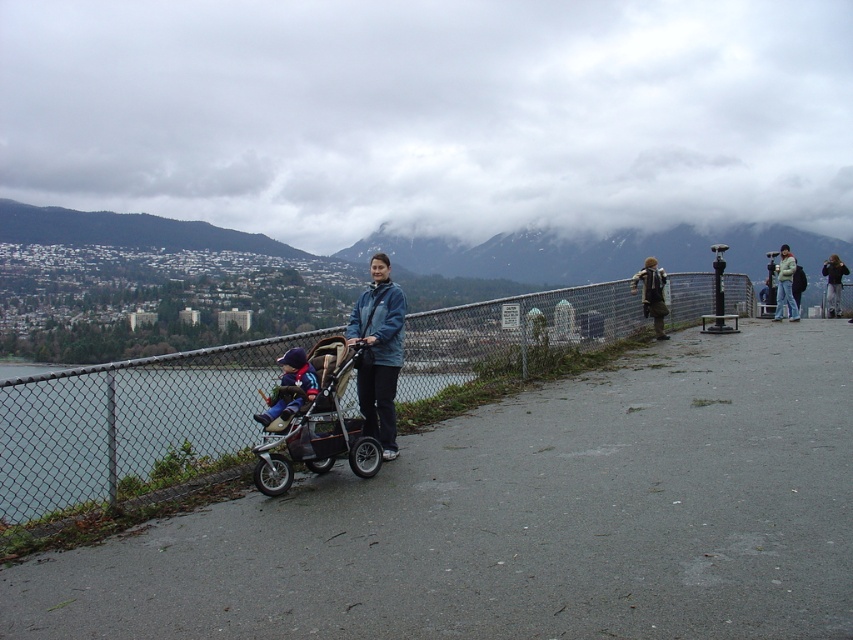
You are a tourist visiting the viewpoint and want to take a photo of the clear water at stroller left and the blue fleece jacket at center. Which object should you focus on first if you want to capture both in the same frame without moving your camera?

The clear water at stroller left is positioned on the left side of the blue fleece jacket at center, so you should focus on the blue fleece jacket at center first to ensure both are in the frame.

Based on the photo, you are a photographer planning to take a picture of the clear water at stroller left and the blue fleece jacket at center. Which object should you focus on first if you want to capture both in a single shot without moving the camera?

The blue fleece jacket at center is closer to the photographer than the clear water at stroller left, so focusing on the blue fleece jacket at center first will ensure both are in focus.

You are a photographer at the viewpoint. You want to capture a photo of the blue fleece jacket at center without the clear water at stroller left appearing in the foreground. Is this possible given their positions?

The clear water at stroller left is positioned under the blue fleece jacket at center, so the jacket is above the water. By angling the camera upwards to focus on the jacket while avoiding the lower area where the water is located, it should be possible to exclude the clear water at stroller left from the foreground of the photo.